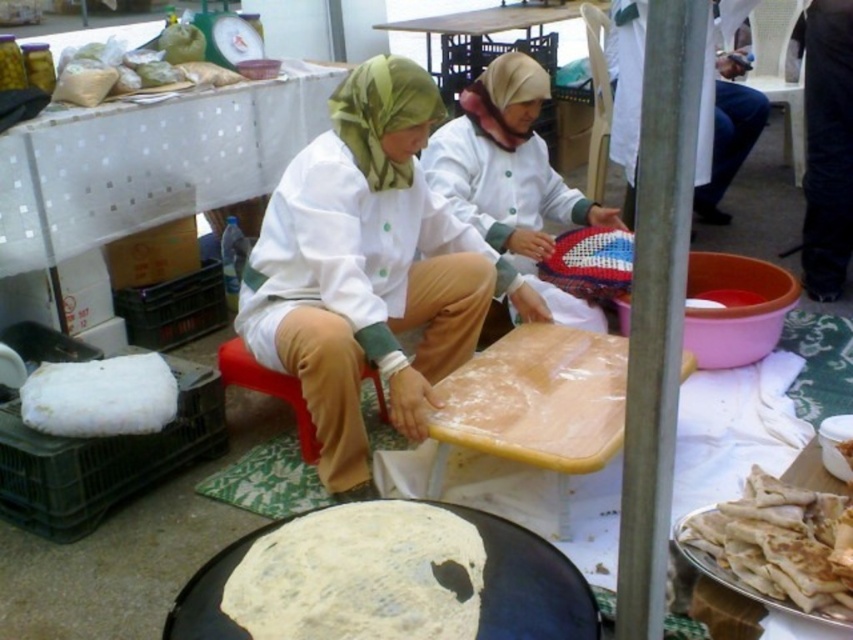
You are a new worker in the kitchen and need to find your assigned workstation. You see the matte white shirt at center and the red plastic stool at lower center. Which object is positioned more to the right side of the scene?

The matte white shirt at center is to the right of the red plastic stool at lower center, so the matte white shirt at center is positioned more to the right side of the scene.

Consider the image. You are a food inspector and need to check the cleanliness of the area where the dough is being prepared. The dough is on a wooden board at the center. According to the image, is the wooden board near the point at coordinates [368,268] covered by any part of the white shirt? Please answer yes or no.

Yes, the point at coordinates [368,268] is on the matte white shirt at center, so the wooden board at the center is covered by the white shirt.